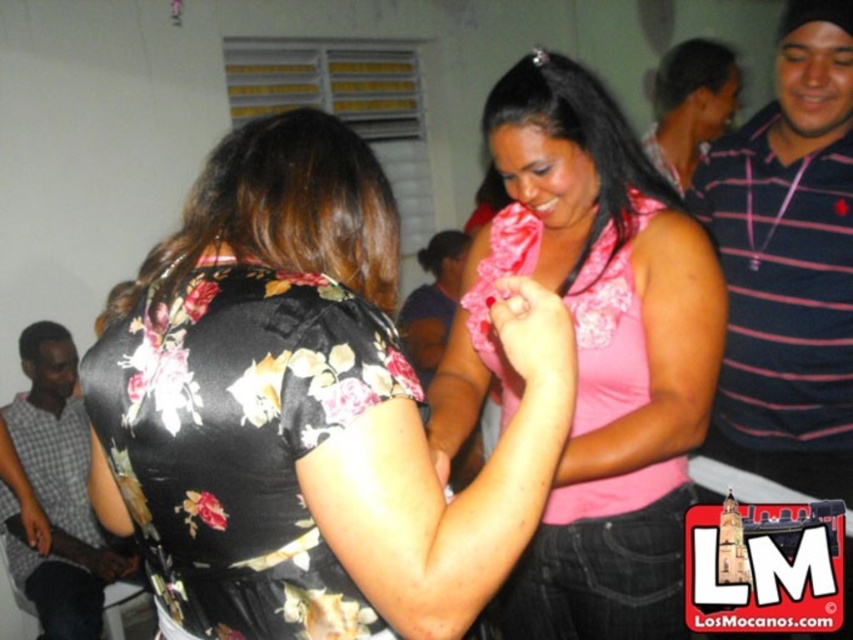
You are organizing a charity clothing drive and need to pack two shirts into a small box. The striped cotton shirt at right and the striped polo shirt at upper right must be placed in the box. Given their sizes, which shirt should you place first to ensure both fit?

The striped cotton shirt at right occupies less space than the striped polo shirt at upper right, so you should place the striped polo shirt at upper right first to make space for the smaller one.

From the picture: You are standing at a distance of 25 inches from the point labeled as point (529, 512). Can you reach it without moving closer?

The distance of point (529, 512) from viewer is 30.13 inches, so you are currently 25 inches away from it. Therefore, you need to move 5.13 inches closer to reach it.